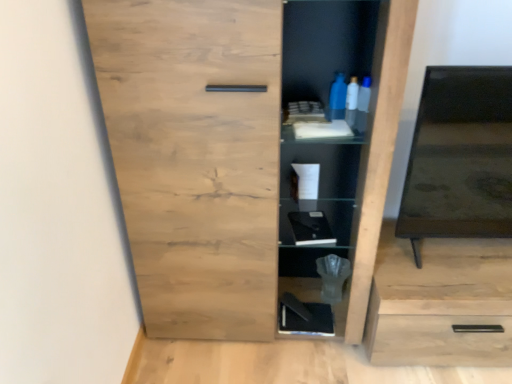
Question: Based on their positions, is black matte book at lower center, the second cabinet when ordered from front to back, located to the left or right of light wood drawer at lower right?

Choices:
 (A) right
 (B) left

Answer: (B)

Question: From the image's perspective, relative to light wood drawer at lower right, is black matte book at lower center, acting as the 2th cabinet starting from the top, above or below?

Choices:
 (A) below
 (B) above

Answer: (A)

Question: Estimate the real-world distances between objects in this image. Which object is farther from the natural wood cupboard at center?

Choices:
 (A) black matte book at lower center, which ranks as the first cabinet in back-to-front order
 (B) black glossy tv at right
 (C) light wood drawer at lower right
 (D) black plastic scale at center, placed as the 2th cabinet when sorted from bottom to top

Answer: (A)

Question: Estimate the real-world distances between objects in this image. Which object is farther from the black glossy tv at right?

Choices:
 (A) light wood drawer at lower right
 (B) black matte book at lower center, arranged as the 1th cabinet when ordered from the bottom
 (C) natural wood cupboard at center
 (D) black plastic scale at center, which ranks as the first cabinet in front-to-back order

Answer: (B)